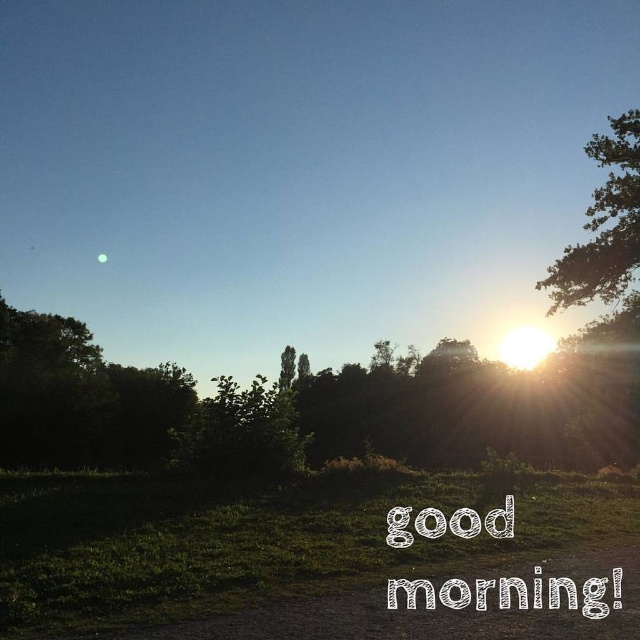
Does green leafy tree at upper right appear on the left side of greenish-gray sphere at upper left?

In fact, green leafy tree at upper right is to the right of greenish-gray sphere at upper left.

Which is above, green leafy tree at upper right or greenish-gray sphere at upper left?

green leafy tree at upper right is above.

The width and height of the screenshot is (640, 640). Describe the element at coordinates (604, 227) in the screenshot. I see `green leafy tree at upper right` at that location.

At what (x,y) coordinates should I click in order to perform the action: click on green leafy tree at upper right. Please return your answer as a coordinate pair (x, y). The width and height of the screenshot is (640, 640). Looking at the image, I should click on (604, 227).

Between green leafy tree at center and greenish-gray sphere at upper left, which one appears on the right side from the viewer's perspective?

Positioned to the right is green leafy tree at center.

Which is in front, point (288, 352) or point (104, 257)?

Point (288, 352) is in front.

Identify the location of green leafy tree at center. This screenshot has height=640, width=640. (288, 365).

Does green leafy tree at upper right have a lesser height compared to green leafy tree at center?

In fact, green leafy tree at upper right may be taller than green leafy tree at center.

Between point (589, 273) and point (285, 369), which one is positioned in front?

Point (589, 273)

The height and width of the screenshot is (640, 640). What do you see at coordinates (604, 227) in the screenshot?
I see `green leafy tree at upper right` at bounding box center [604, 227].

This screenshot has height=640, width=640. I want to click on green leafy tree at upper right, so click(604, 227).